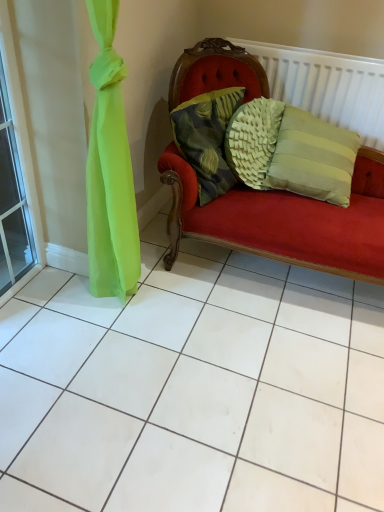
Question: Does white textured radiator at upper right have a smaller size compared to textured green pillow at center?

Choices:
 (A) no
 (B) yes

Answer: (A)

Question: Is white textured radiator at upper right turned away from textured green pillow at center?

Choices:
 (A) yes
 (B) no

Answer: (B)

Question: Can you confirm if white textured radiator at upper right is taller than textured green pillow at center?

Choices:
 (A) no
 (B) yes

Answer: (B)

Question: Is white textured radiator at upper right next to textured green pillow at center and touching it?

Choices:
 (A) yes
 (B) no

Answer: (B)

Question: Is white textured radiator at upper right facing towards textured green pillow at center?

Choices:
 (A) yes
 (B) no

Answer: (A)

Question: From a real-world perspective, is transparent glass window at left above or below white textured radiator at upper right?

Choices:
 (A) above
 (B) below

Answer: (B)

Question: From their relative heights in the image, would you say transparent glass window at left is taller or shorter than white textured radiator at upper right?

Choices:
 (A) tall
 (B) short

Answer: (A)

Question: Is transparent glass window at left wider or thinner than white textured radiator at upper right?

Choices:
 (A) thin
 (B) wide

Answer: (A)

Question: In the image, is transparent glass window at left positioned in front of or behind white textured radiator at upper right?

Choices:
 (A) behind
 (B) front

Answer: (B)

Question: From a real-world perspective, is transparent glass window at left above or below textured green pillow at center?

Choices:
 (A) above
 (B) below

Answer: (B)

Question: Visually, is transparent glass window at left positioned to the left or to the right of textured green pillow at center?

Choices:
 (A) left
 (B) right

Answer: (A)

Question: Looking at the image, does transparent glass window at left seem bigger or smaller compared to textured green pillow at center?

Choices:
 (A) small
 (B) big

Answer: (A)

Question: Does point (8, 30) appear closer or farther from the camera than point (210, 197)?

Choices:
 (A) closer
 (B) farther

Answer: (A)

Question: Considering the positions of point (301, 74) and point (235, 95), is point (301, 74) closer or farther from the camera than point (235, 95)?

Choices:
 (A) farther
 (B) closer

Answer: (A)

Question: In the image, is white textured radiator at upper right on the left side or the right side of textured green pillow at center?

Choices:
 (A) right
 (B) left

Answer: (A)